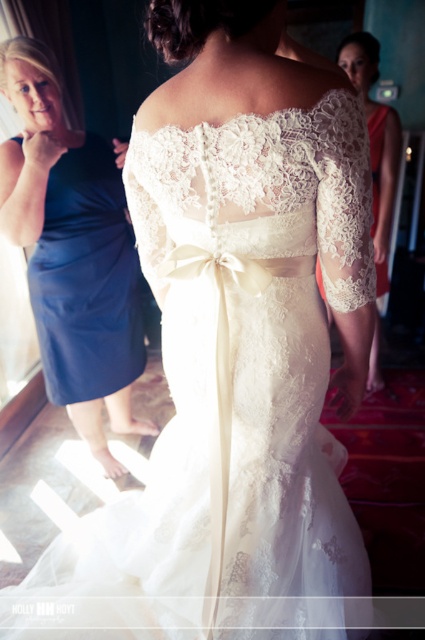
You are a photographer setting up for a photoshoot. You have two dresses to feature in the image. The blue satin dress at left and the lace fabric dress at upper right. Based on their positions and sizes in the scene, which dress should you focus on to ensure it appears larger in the final photograph?

The blue satin dress at left should be focused on because it has a greater height compared to the lace fabric dress at upper right, making it appear larger in the photograph.

You are a photographer setting up for a photoshoot and need to decide where to place the spotlight. You see the blue satin dress at left and the lace fabric dress at upper right. Which dress is closer to the window providing natural light?

The lace fabric dress at upper right is closer to the window providing natural light because it is positioned above the blue satin dress at left, which is under it.

Consider the image. You are a photographer adjusting your camera settings to capture the wedding dress details. You notice two points marked in the scene. Which point, point (x=59, y=400) or point (x=384, y=200), is closer to you?

Point (x=59, y=400) is closer to the viewer than point (x=384, y=200).